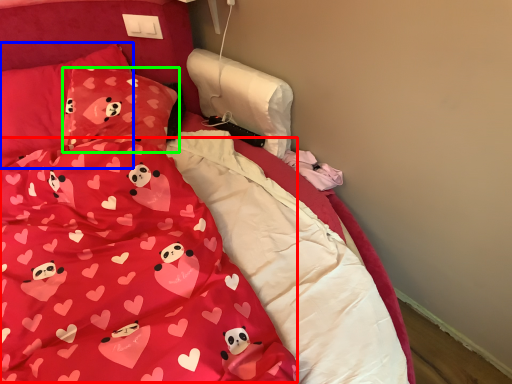
Question: Which object is the closest to the blanket (highlighted by a red box)? Choose among these: pillow (highlighted by a blue box) or pillow (highlighted by a green box).

Choices:
 (A) pillow
 (B) pillow

Answer: (B)